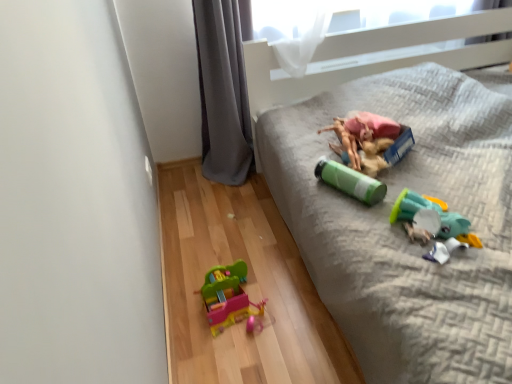
Question: Are multicolored plastic toy at lower center, marked as the 1th toy in a bottom-to-top arrangement, and rubberized plastic toy at center, the first toy when ordered from top to bottom, located far from each other?

Choices:
 (A) yes
 (B) no

Answer: (B)

Question: From the image's perspective, is multicolored plastic toy at lower center, marked as the 1th toy in a bottom-to-top arrangement, under rubberized plastic toy at center, the 4th toy in the bottom-to-top sequence?

Choices:
 (A) yes
 (B) no

Answer: (A)

Question: Does multicolored plastic toy at lower center, the 4th toy positioned from the top, have a larger size compared to rubberized plastic toy at center, the 4th toy in the bottom-to-top sequence?

Choices:
 (A) yes
 (B) no

Answer: (B)

Question: Can you confirm if multicolored plastic toy at lower center, marked as the 1th toy in a bottom-to-top arrangement, is positioned to the left of rubberized plastic toy at center, the first toy when ordered from top to bottom?

Choices:
 (A) yes
 (B) no

Answer: (A)

Question: Is multicolored plastic toy at lower center, the 4th toy positioned from the top, positioned with its back to rubberized plastic toy at center, the first toy when ordered from top to bottom?

Choices:
 (A) yes
 (B) no

Answer: (B)

Question: Considering the positions of green matte water bottle at center, positioned as the 3th toy in bottom-to-top order, and rubberized plastic toy at center, the 4th toy in the bottom-to-top sequence, in the image, is green matte water bottle at center, positioned as the 3th toy in bottom-to-top order, wider or thinner than rubberized plastic toy at center, the 4th toy in the bottom-to-top sequence,?

Choices:
 (A) thin
 (B) wide

Answer: (A)

Question: Is green matte water bottle at center, positioned as the 3th toy in bottom-to-top order, bigger or smaller than rubberized plastic toy at center, the 4th toy in the bottom-to-top sequence?

Choices:
 (A) big
 (B) small

Answer: (B)

Question: Choose the correct answer: Is green matte water bottle at center, the 2th toy viewed from the top, inside rubberized plastic toy at center, the 4th toy in the bottom-to-top sequence, or outside it?

Choices:
 (A) inside
 (B) outside

Answer: (B)

Question: Considering the positions of green matte water bottle at center, the 2th toy viewed from the top, and rubberized plastic toy at center, the 4th toy in the bottom-to-top sequence, in the image, is green matte water bottle at center, the 2th toy viewed from the top, taller or shorter than rubberized plastic toy at center, the 4th toy in the bottom-to-top sequence,?

Choices:
 (A) short
 (B) tall

Answer: (A)

Question: Considering the positions of translucent plastic toy at lower right, the 2th toy ordered from the bottom, and multicolored plastic toy at lower center, marked as the 1th toy in a bottom-to-top arrangement, in the image, is translucent plastic toy at lower right, the 2th toy ordered from the bottom, taller or shorter than multicolored plastic toy at lower center, marked as the 1th toy in a bottom-to-top arrangement,?

Choices:
 (A) tall
 (B) short

Answer: (B)

Question: Considering the positions of translucent plastic toy at lower right, the 2th toy ordered from the bottom, and multicolored plastic toy at lower center, marked as the 1th toy in a bottom-to-top arrangement, in the image, is translucent plastic toy at lower right, the 2th toy ordered from the bottom, bigger or smaller than multicolored plastic toy at lower center, marked as the 1th toy in a bottom-to-top arrangement,?

Choices:
 (A) small
 (B) big

Answer: (A)

Question: From the image's perspective, relative to multicolored plastic toy at lower center, the 4th toy positioned from the top, is translucent plastic toy at lower right, the 2th toy ordered from the bottom, above or below?

Choices:
 (A) above
 (B) below

Answer: (A)

Question: From a real-world perspective, relative to multicolored plastic toy at lower center, marked as the 1th toy in a bottom-to-top arrangement, is translucent plastic toy at lower right, the third toy in the top-to-bottom sequence, vertically above or below?

Choices:
 (A) below
 (B) above

Answer: (B)

Question: Considering their positions, is multicolored plastic toy at lower center, marked as the 1th toy in a bottom-to-top arrangement, located in front of or behind green matte water bottle at center, the 2th toy viewed from the top?

Choices:
 (A) behind
 (B) front

Answer: (A)

Question: From their relative heights in the image, would you say multicolored plastic toy at lower center, the 4th toy positioned from the top, is taller or shorter than green matte water bottle at center, the 2th toy viewed from the top?

Choices:
 (A) short
 (B) tall

Answer: (B)